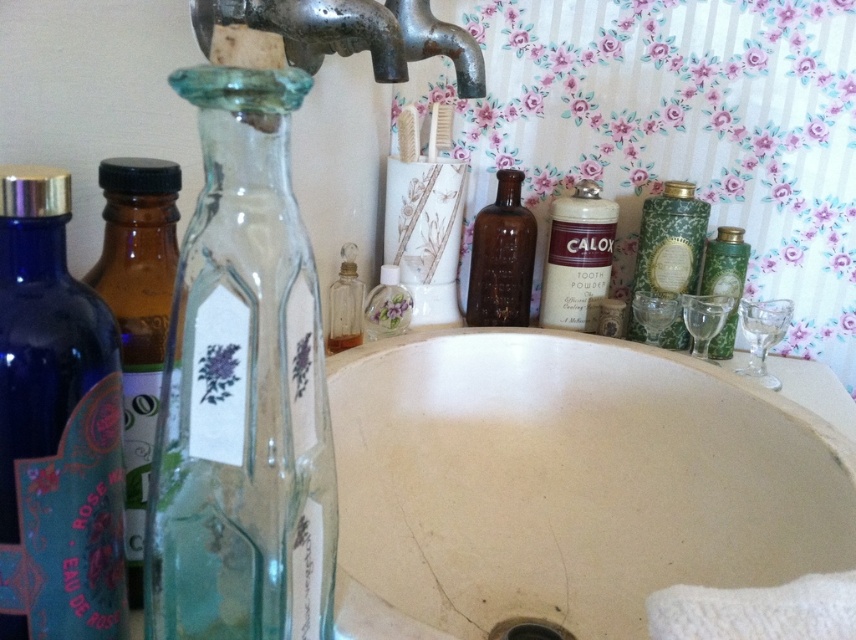
Is point (337, 26) positioned in front of point (694, 221)?

Yes, it is in front of point (694, 221).

Does rusty metal faucet at upper center appear over green matte powder container at upper right?

Yes, rusty metal faucet at upper center is above green matte powder container at upper right.

Is point (406, 52) behind point (663, 221)?

That is False.

Locate an element on the screen. rusty metal faucet at upper center is located at coordinates (349, 33).

Can you confirm if transparent glass bottle at left is positioned below amber glass bottle at left?

No.

Which is above, transparent glass bottle at left or amber glass bottle at left?

transparent glass bottle at left

Is point (179, 92) positioned in front of point (116, 198)?

Yes.

This screenshot has width=856, height=640. Identify the location of transparent glass bottle at left. (x=242, y=388).

Which of these two, brown glass bottle at center or green matte powder container at upper right, stands taller?

green matte powder container at upper right

Is brown glass bottle at center further to the viewer compared to green matte powder container at upper right?

Yes, it is.

Which is in front, point (514, 269) or point (687, 212)?

Point (687, 212)

Image resolution: width=856 pixels, height=640 pixels. What are the coordinates of `brown glass bottle at center` in the screenshot? It's located at (501, 257).